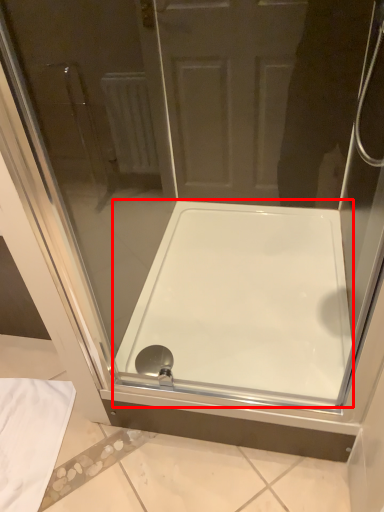
Question: From the image's perspective, what is the correct spatial relationship of bathtub (annotated by the red box) in relation to shower?

Choices:
 (A) above
 (B) below

Answer: (A)